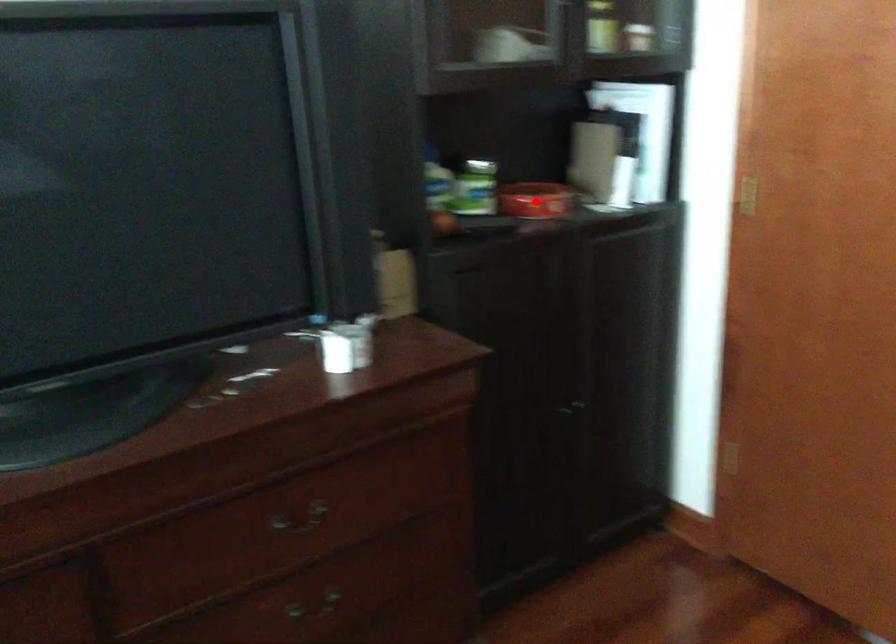
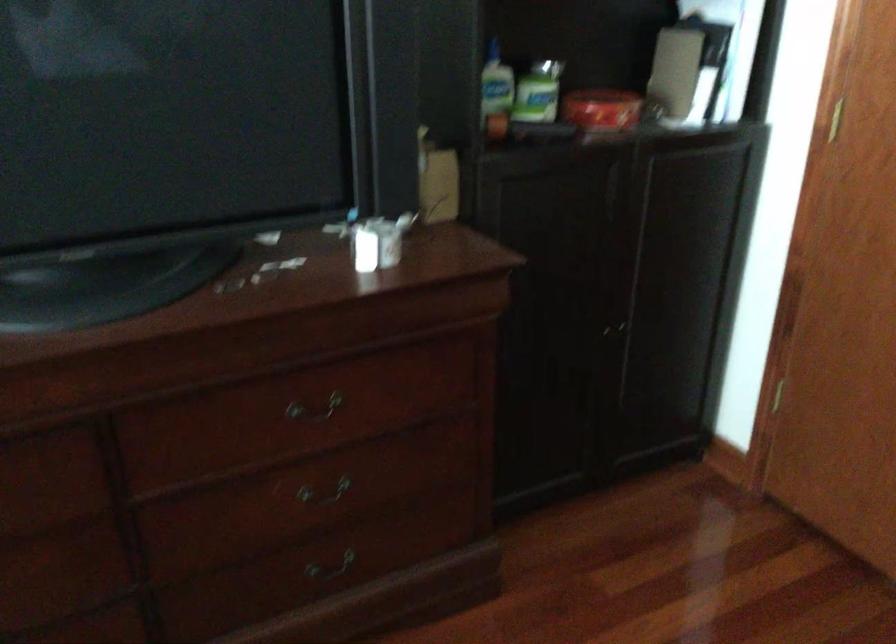
In the second image, find the point that corresponds to the highlighted location in the first image.

(600, 109)